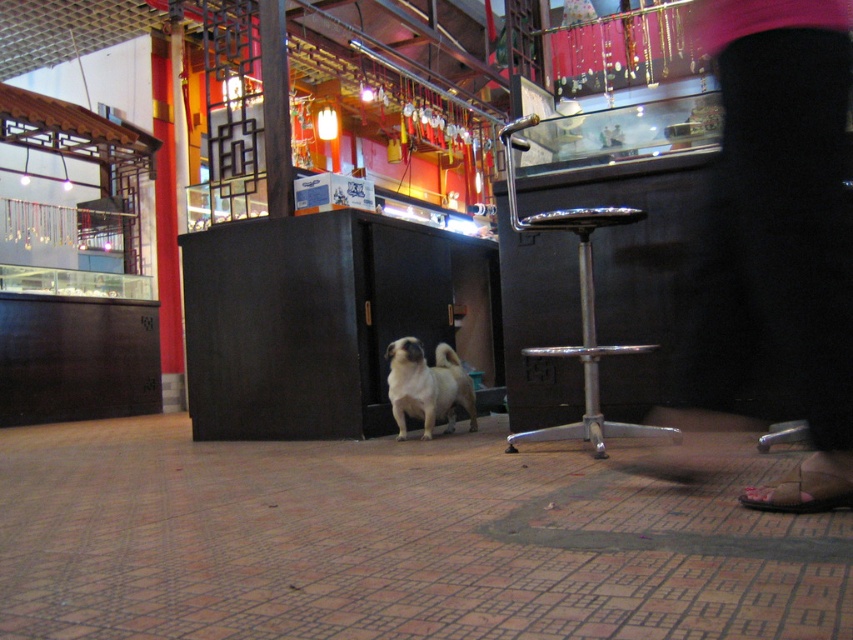
Can you confirm if black fabric pants at lower right is taller than polished chrome bar stool at center?

Correct, black fabric pants at lower right is much taller as polished chrome bar stool at center.

Is black fabric pants at lower right further to the viewer compared to polished chrome bar stool at center?

No, it is not.

Describe the element at coordinates (780, 230) in the screenshot. I see `black fabric pants at lower right` at that location.

I want to click on black fabric pants at lower right, so click(x=780, y=230).

In the scene shown: Does black fabric pants at lower right have a larger size compared to light brown fur at center?

Correct, black fabric pants at lower right is larger in size than light brown fur at center.

Does black fabric pants at lower right have a lesser width compared to light brown fur at center?

Yes, black fabric pants at lower right is thinner than light brown fur at center.

Is point (724, 260) farther from camera compared to point (428, 396)?

No, (724, 260) is closer to viewer.

What are the coordinates of `black fabric pants at lower right` in the screenshot? It's located at (780, 230).

The width and height of the screenshot is (853, 640). Identify the location of polished chrome bar stool at center. (584, 332).

Locate an element on the screen. The height and width of the screenshot is (640, 853). polished chrome bar stool at center is located at coordinates (584, 332).